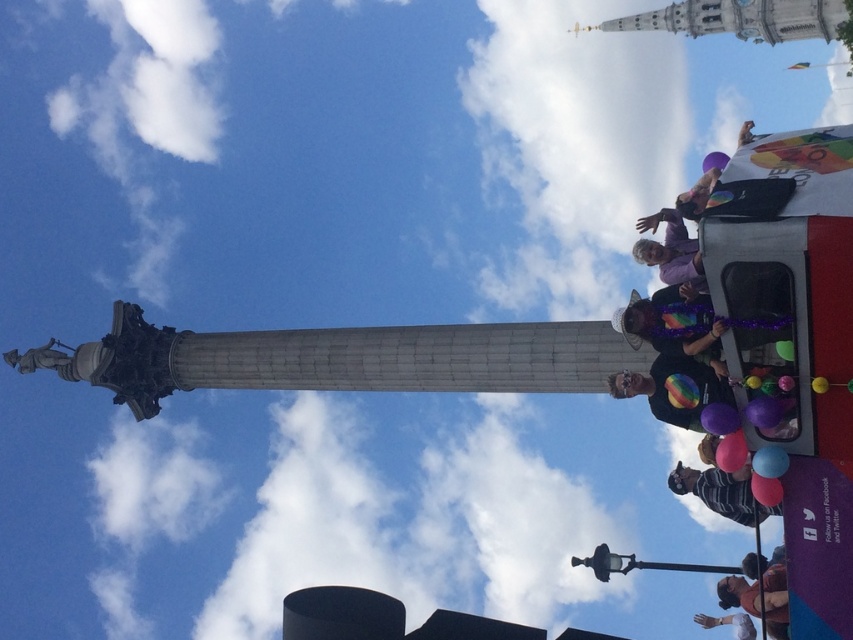
You are standing at the point with coordinates point (776, 484) and want to walk towards the point with coordinates point (735, 419). Will you be moving forward or backward in the scene?

Since point (735, 419) is behind point (776, 484), moving towards it would mean moving backward in the scene.

You are a photographer standing at the center of the scene. You want to take a photo that includes both the matte blue balloon at lower right and the rubber balloon at lower right. What is the minimum distance you need to move towards the balloons to ensure both are in frame?

The matte blue balloon at lower right and the rubber balloon at lower right are 4.66 feet apart from each other. To include both in the frame, you need to move close enough so that the distance between them fits within your camera lens field of view. However, without knowing the camera lens specifications, it is impossible to determine the exact distance required. Therefore, you should move closer until both balloons are visible in the frame.